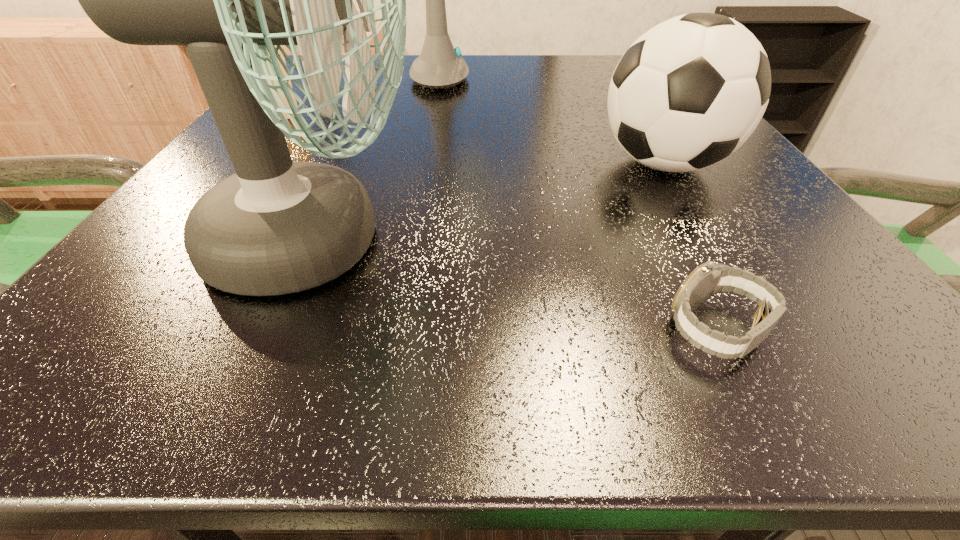
Where is `free space that satisfies the following two spatial constraints: 1. on the front-facing side of the farther fan; 2. on the left side of the third shortest object`? The image size is (960, 540). free space that satisfies the following two spatial constraints: 1. on the front-facing side of the farther fan; 2. on the left side of the third shortest object is located at coordinates (438, 164).